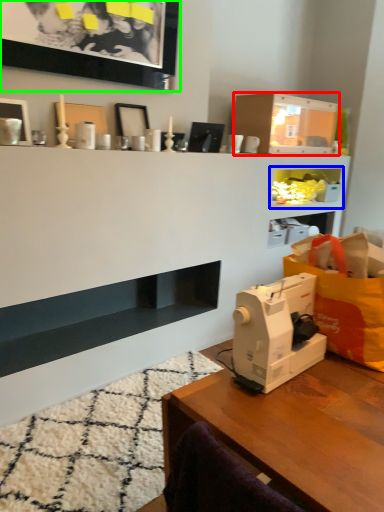
Question: Which object is positioned closest to shelf (highlighted by a red box)? Select from cabinet (highlighted by a blue box) and picture frame (highlighted by a green box).

Choices:
 (A) cabinet
 (B) picture frame

Answer: (A)